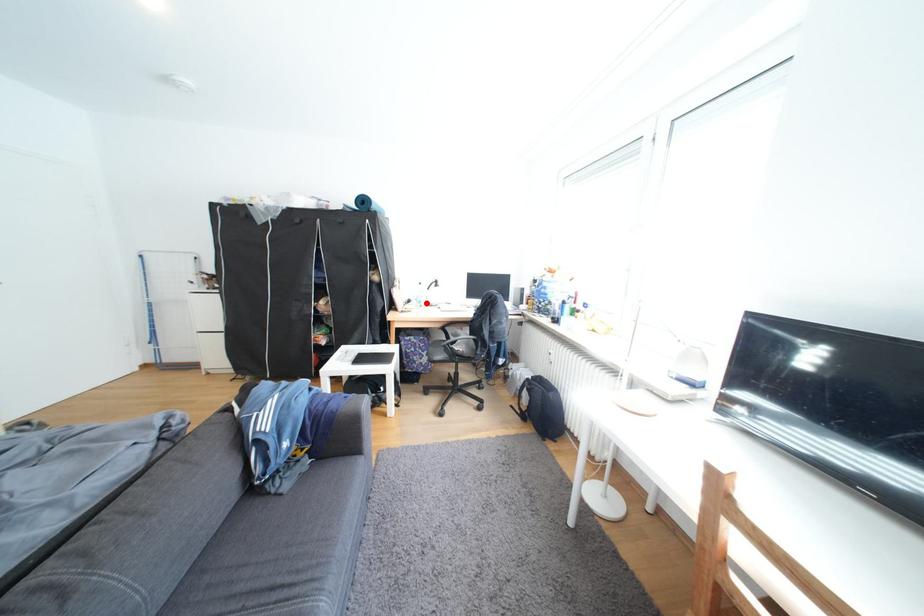
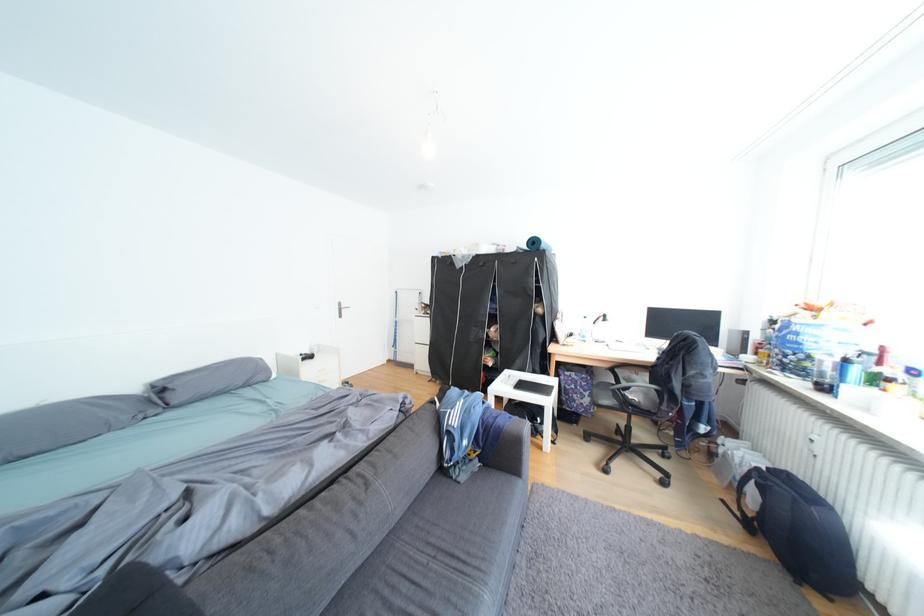
The point at the highlighted location is marked in the first image. Where is the corresponding point in the second image?

(590, 337)